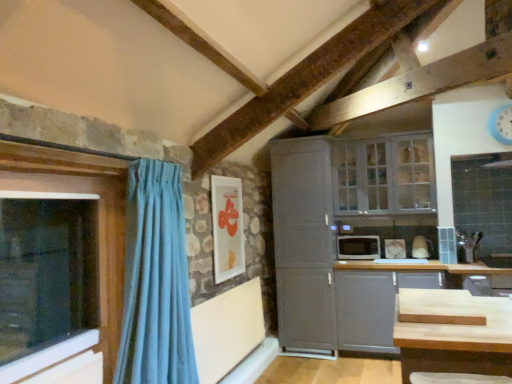
Question: Is white glossy picture frame at upper center facing towards light blue fabric curtain at left?

Choices:
 (A) no
 (B) yes

Answer: (A)

Question: Considering the relative sizes of white glossy picture frame at upper center and light blue fabric curtain at left in the image provided, is white glossy picture frame at upper center thinner than light blue fabric curtain at left?

Choices:
 (A) no
 (B) yes

Answer: (B)

Question: Is white glossy picture frame at upper center located outside light blue fabric curtain at left?

Choices:
 (A) yes
 (B) no

Answer: (A)

Question: Is white glossy picture frame at upper center not close to light blue fabric curtain at left?

Choices:
 (A) no
 (B) yes

Answer: (B)

Question: Is white glossy picture frame at upper center beside light blue fabric curtain at left?

Choices:
 (A) yes
 (B) no

Answer: (B)

Question: Do you think white glossy picture frame at upper center is within satin gray cabinet at center, positioned as the second cabinetry in right-to-left order, or outside of it?

Choices:
 (A) inside
 (B) outside

Answer: (B)

Question: Is point (222, 192) closer or farther from the camera than point (288, 301)?

Choices:
 (A) farther
 (B) closer

Answer: (B)

Question: Considering the positions of white glossy picture frame at upper center and satin gray cabinet at center, positioned as the first cabinetry in left-to-right order, in the image, is white glossy picture frame at upper center bigger or smaller than satin gray cabinet at center, positioned as the first cabinetry in left-to-right order,?

Choices:
 (A) big
 (B) small

Answer: (B)

Question: In the image, is white glossy picture frame at upper center on the left side or the right side of satin gray cabinet at center, positioned as the first cabinetry in left-to-right order?

Choices:
 (A) left
 (B) right

Answer: (A)

Question: Relative to matte gray cabinet at lower right, which ranks as the first cabinetry in right-to-left order, is blue plastic clock at upper right in front or behind?

Choices:
 (A) front
 (B) behind

Answer: (A)

Question: Considering the positions of blue plastic clock at upper right and matte gray cabinet at lower right, placed as the 2th cabinetry when sorted from left to right, in the image, is blue plastic clock at upper right wider or thinner than matte gray cabinet at lower right, placed as the 2th cabinetry when sorted from left to right,?

Choices:
 (A) wide
 (B) thin

Answer: (B)

Question: In terms of height, does blue plastic clock at upper right look taller or shorter compared to matte gray cabinet at lower right, which ranks as the first cabinetry in right-to-left order?

Choices:
 (A) short
 (B) tall

Answer: (A)

Question: From the image's perspective, is blue plastic clock at upper right positioned above or below matte gray cabinet at lower right, placed as the 2th cabinetry when sorted from left to right?

Choices:
 (A) above
 (B) below

Answer: (A)

Question: Does point (x=74, y=178) appear closer or farther from the camera than point (x=387, y=137)?

Choices:
 (A) closer
 (B) farther

Answer: (A)

Question: Would you say transparent glass window at left, placed as the 1th window when sorted from left to right, is to the left or to the right of white glass cabinet at upper right, which is the 1th window from back to front, in the picture?

Choices:
 (A) right
 (B) left

Answer: (B)